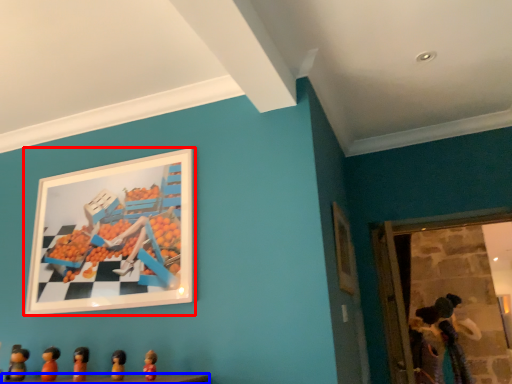
Question: Which object is further to the camera taking this photo, picture frame (highlighted by a red box) or table (highlighted by a blue box)?

Choices:
 (A) picture frame
 (B) table

Answer: (A)